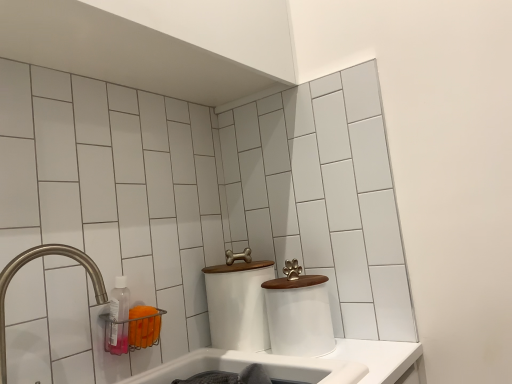
Where is `brushed metal faucet at left`? The height and width of the screenshot is (384, 512). brushed metal faucet at left is located at coordinates (31, 260).

What do you see at coordinates (238, 305) in the screenshot?
I see `white matte toilet paper at center, the second toilet paper from the right` at bounding box center [238, 305].

How much space does white matte toilet paper at center, which is counted as the 2th toilet paper, starting from the left, occupy horizontally?

white matte toilet paper at center, which is counted as the 2th toilet paper, starting from the left, is 7.33 inches in width.

At what (x,y) coordinates should I click in order to perform the action: click on brushed metal faucet at left. Please return your answer as a coordinate pair (x, y). Looking at the image, I should click on (31, 260).

The height and width of the screenshot is (384, 512). Identify the location of tap that appears in front of the white matte toilet paper at center, placed as the first toilet paper when sorted from left to right. (31, 260).

From a real-world perspective, who is located lower, white matte toilet paper at center, the second toilet paper from the right, or brushed metal faucet at left?

From a 3D spatial view, white matte toilet paper at center, the second toilet paper from the right, is below.

From the image's perspective, is white matte toilet paper at center, the second toilet paper from the right, above or below brushed metal faucet at left?

Based on their image positions, white matte toilet paper at center, the second toilet paper from the right, is located beneath brushed metal faucet at left.

Looking at their sizes, would you say white matte toilet paper at center, the second toilet paper from the right, is wider or thinner than brushed metal faucet at left?

Considering their sizes, white matte toilet paper at center, the second toilet paper from the right, looks broader than brushed metal faucet at left.

From the picture: Is brushed metal faucet at left facing away from white matte toilet paper at center, which is counted as the 2th toilet paper, starting from the left?

That's not correct — brushed metal faucet at left is not looking away from white matte toilet paper at center, which is counted as the 2th toilet paper, starting from the left.

Is brushed metal faucet at left closer to camera compared to white matte toilet paper at center, the 1th toilet paper in the right-to-left sequence?

That is True.

Which object is thinner, brushed metal faucet at left or white matte toilet paper at center, the 1th toilet paper in the right-to-left sequence?

brushed metal faucet at left.

How many degrees apart are the facing directions of brushed metal faucet at left and white matte toilet paper at center, the 1th toilet paper in the right-to-left sequence?

The facing directions of brushed metal faucet at left and white matte toilet paper at center, the 1th toilet paper in the right-to-left sequence, are 0.000753 degrees apart.

Which is farther from the camera, (4, 355) or (320, 358)?

The point (320, 358) is behind.

Is brushed metal faucet at left inside or outside of white plastic bath at lower center?

brushed metal faucet at left is spatially situated outside white plastic bath at lower center.

Is brushed metal faucet at left facing towards white plastic bath at lower center?

No, brushed metal faucet at left does not turn towards white plastic bath at lower center.

From a real-world perspective, count 1st toilet papers downward from the transparent plastic bottle at lower left and point to it. Please provide its 2D coordinates.

[(238, 305)]

Which object is wider, transparent plastic bottle at lower left or white matte toilet paper at center, the second toilet paper from the right?

white matte toilet paper at center, the second toilet paper from the right.

From the image's perspective, does transparent plastic bottle at lower left appear higher than white matte toilet paper at center, the second toilet paper from the right?

Yes, from the image's perspective, transparent plastic bottle at lower left is above white matte toilet paper at center, the second toilet paper from the right.

Who is smaller, transparent plastic bottle at lower left or white matte toilet paper at center, placed as the first toilet paper when sorted from left to right?

With smaller size is transparent plastic bottle at lower left.

Considering the sizes of white matte toilet paper at center, which is counted as the 2th toilet paper, starting from the left, and brushed metal faucet at left in the image, is white matte toilet paper at center, which is counted as the 2th toilet paper, starting from the left, wider or thinner than brushed metal faucet at left?

Clearly, white matte toilet paper at center, which is counted as the 2th toilet paper, starting from the left, has more width compared to brushed metal faucet at left.

Based on the photo, from a real-world perspective, is white matte toilet paper at center, the 1th toilet paper in the right-to-left sequence, on brushed metal faucet at left?

No.

Is white matte toilet paper at center, the 1th toilet paper in the right-to-left sequence, spatially inside brushed metal faucet at left, or outside of it?

white matte toilet paper at center, the 1th toilet paper in the right-to-left sequence, lies outside brushed metal faucet at left.

Who is smaller, white matte toilet paper at center, which is counted as the 2th toilet paper, starting from the left, or brushed metal faucet at left?

brushed metal faucet at left is smaller.

How different are the orientations of transparent plastic bottle at lower left and white matte toilet paper at center, the 1th toilet paper in the right-to-left sequence, in degrees?

The angle between the facing direction of transparent plastic bottle at lower left and the facing direction of white matte toilet paper at center, the 1th toilet paper in the right-to-left sequence, is 1.14 degrees.

Which object is more forward, transparent plastic bottle at lower left or white matte toilet paper at center, the 1th toilet paper in the right-to-left sequence?

transparent plastic bottle at lower left is in front.

Is transparent plastic bottle at lower left bigger than white matte toilet paper at center, the 1th toilet paper in the right-to-left sequence?

No, transparent plastic bottle at lower left is not bigger than white matte toilet paper at center, the 1th toilet paper in the right-to-left sequence.

From a real-world perspective, which is physically above, transparent plastic bottle at lower left or white matte toilet paper at center, which is counted as the 2th toilet paper, starting from the left?

transparent plastic bottle at lower left, from a real-world perspective.

From the image's perspective, which is above, brushed metal faucet at left or transparent plastic bottle at lower left?

brushed metal faucet at left.

How far apart are brushed metal faucet at left and transparent plastic bottle at lower left?

They are 7.03 inches apart.

Can you confirm if brushed metal faucet at left is taller than transparent plastic bottle at lower left?

Yes, brushed metal faucet at left is taller than transparent plastic bottle at lower left.

From a real-world perspective, who is located lower, brushed metal faucet at left or transparent plastic bottle at lower left?

transparent plastic bottle at lower left, from a real-world perspective.

This screenshot has height=384, width=512. What are the coordinates of `tap to the left of white matte toilet paper at center, placed as the first toilet paper when sorted from left to right` in the screenshot? It's located at (31, 260).

Starting from the brushed metal faucet at left, which toilet paper is the 2nd one to the right? Please provide its 2D coordinates.

[(298, 316)]

Based on their spatial positions, is white matte toilet paper at center, the second toilet paper from the right, or white matte toilet paper at center, the 1th toilet paper in the right-to-left sequence, closer to transparent plastic bottle at lower left?

white matte toilet paper at center, the second toilet paper from the right, lies closer to transparent plastic bottle at lower left than the other object.

Looking at the image, which one is located closer to brushed metal faucet at left, white matte toilet paper at center, the second toilet paper from the right, or white matte toilet paper at center, which is counted as the 2th toilet paper, starting from the left?

Based on the image, white matte toilet paper at center, the second toilet paper from the right, appears to be nearer to brushed metal faucet at left.

From the image, which object appears to be nearer to transparent plastic bottle at lower left, white plastic bath at lower center or white matte toilet paper at center, the 1th toilet paper in the right-to-left sequence?

Among the two, white plastic bath at lower center is located nearer to transparent plastic bottle at lower left.

Looking at the image, which one is located closer to white matte toilet paper at center, which is counted as the 2th toilet paper, starting from the left, white plastic bath at lower center or brushed metal faucet at left?

Among the two, white plastic bath at lower center is located nearer to white matte toilet paper at center, which is counted as the 2th toilet paper, starting from the left.

Looking at this image, which object lies nearer to the anchor point white matte toilet paper at center, the second toilet paper from the right, brushed metal faucet at left or transparent plastic bottle at lower left?

transparent plastic bottle at lower left is closer to white matte toilet paper at center, the second toilet paper from the right.

Looking at the image, which one is located further to transparent plastic bottle at lower left, white matte toilet paper at center, placed as the first toilet paper when sorted from left to right, or brushed metal faucet at left?

white matte toilet paper at center, placed as the first toilet paper when sorted from left to right, is positioned further to the anchor transparent plastic bottle at lower left.

Considering their positions, is transparent plastic bottle at lower left positioned further to white matte toilet paper at center, placed as the first toilet paper when sorted from left to right, than brushed metal faucet at left?

brushed metal faucet at left is further to white matte toilet paper at center, placed as the first toilet paper when sorted from left to right.

Consider the image. Estimate the real-world distances between objects in this image. Which object is further from white plastic bath at lower center, brushed metal faucet at left or white matte toilet paper at center, the second toilet paper from the right?

Among the two, brushed metal faucet at left is located further to white plastic bath at lower center.

Locate an element on the screen. bottle located between brushed metal faucet at left and white matte toilet paper at center, placed as the first toilet paper when sorted from left to right, in the depth direction is located at coordinates (119, 317).

This screenshot has height=384, width=512. What are the coordinates of `toilet paper located between white plastic bath at lower center and white matte toilet paper at center, placed as the first toilet paper when sorted from left to right, in the depth direction` in the screenshot? It's located at (298, 316).

Find the location of a particular element. bottle between white plastic bath at lower center and white matte toilet paper at center, placed as the first toilet paper when sorted from left to right, along the z-axis is located at coordinates (119, 317).

Identify the location of bath between brushed metal faucet at left and white matte toilet paper at center, the second toilet paper from the right, in the front-back direction. The height and width of the screenshot is (384, 512). (254, 362).